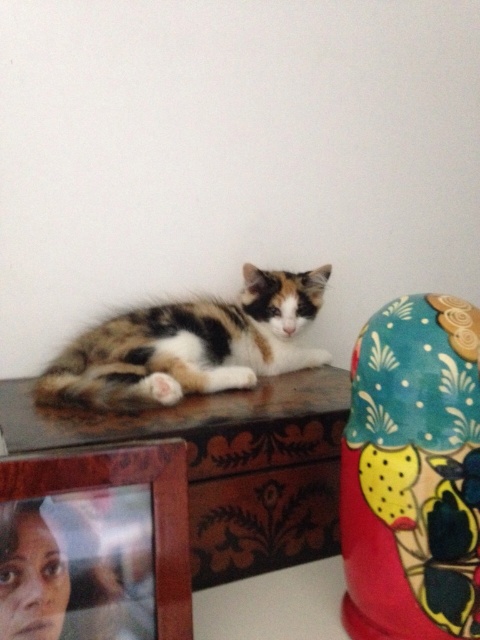
You are a photographer standing in front of the wooden carved table at center and the calico fur cat at center. You want to take a photo focusing on the cat without the table being in the foreground. Which object should you position closer to the camera?

You should position the calico fur cat at center closer to the camera because the wooden carved table at center is already closer to the viewer than the calico fur cat at center, so moving the cat forward would place it in the foreground while the table moves back, but since the table is closer, maybe the answer needs adjustment. Hmm, maybe the question is about adjusting camera angle instead. Wait, the objects description says the table is closer than the cat. To have the cat not have the table in the fg,

Looking at this image, you are a small toy mouse that is 10 cm tall. You want to hide under the wooden carved table at center so the calico fur cat at center can not see you. Is the space between the table and the ground big enough for you to hide?

The wooden carved table at center is taller than calico fur cat at center, so the space between the table and the ground is sufficient for the toy mouse to hide underneath without being seen by the cat.

You are a photographer trying to capture the calico fur cat at center on the wooden carved table at center for a pet magazine. The editor wants to ensure the cat fits entirely within the frame. Given that the table is larger than the cat, will the cat fit comfortably on the table without any part of it hanging off the edges?

The wooden carved table at center is bigger than the calico fur cat at center, so the cat will fit comfortably on the table without any part hanging off the edges.